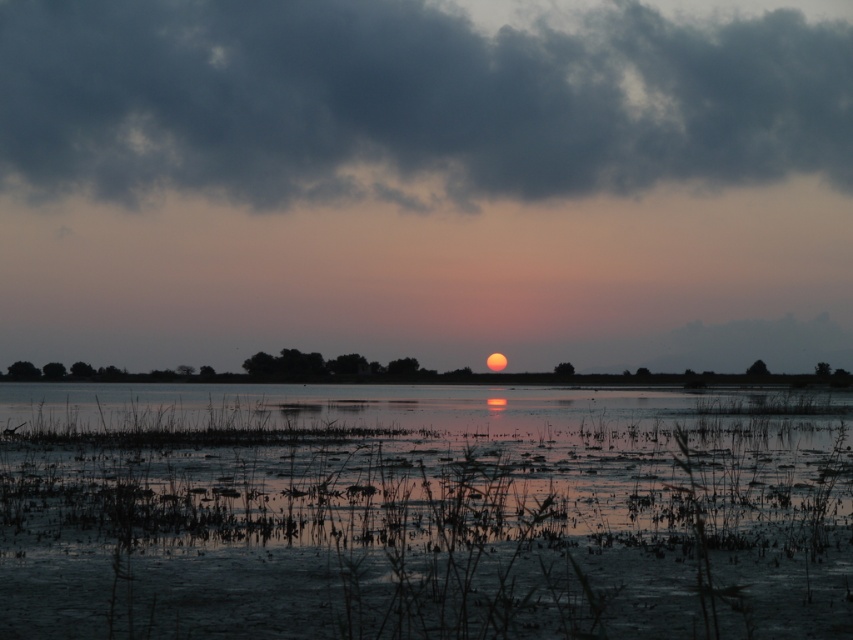
Consider the image. You are standing on a boat in the middle of the lake, and you want to know if you can see the dark gray cloud at upper center from your current position. The reflective wetland at center is between you and the cloud. Can you see the cloud?

The reflective wetland at center is 196.46 feet away from the dark gray cloud at upper center. Since the wetland is between you and the cloud, you can still see the dark gray cloud at upper center as the distance is sufficient for visibility unless obstructed by terrain or objects.

You are an observer standing on the lakeshore. You see the reflective wetland at center and the dark gray cloud at upper center. Which object is closer to the horizon?

The dark gray cloud at upper center is closer to the horizon because it is located above the reflective wetland at center, which is situated below it.